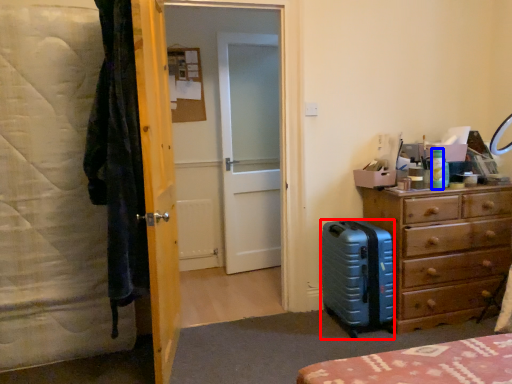
Question: Which of the following is the closest to the observer, suitcase (highlighted by a red box) or bottle (highlighted by a blue box)?

Choices:
 (A) suitcase
 (B) bottle

Answer: (A)